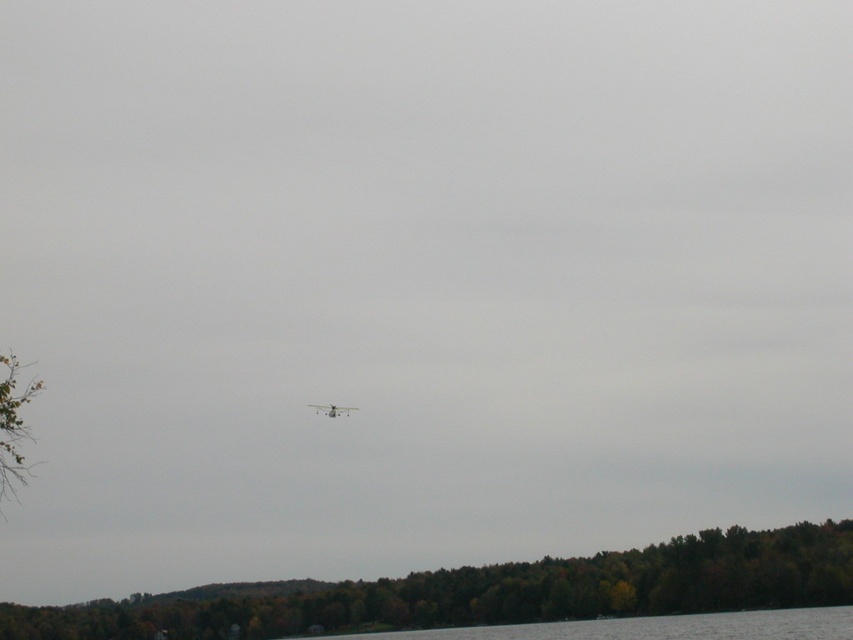
Is green matte tree at lower center further to the viewer compared to clear water at lower center?

Yes, green matte tree at lower center is further from the viewer.

Between point (248, 589) and point (672, 620), which one is positioned in front?

Point (672, 620)

Identify the location of green matte tree at lower center. (485, 592).

Is green matte tree at lower center to the left of metallic silver airplane at center from the viewer's perspective?

Incorrect, green matte tree at lower center is not on the left side of metallic silver airplane at center.

Who is higher up, green matte tree at lower center or metallic silver airplane at center?

metallic silver airplane at center is higher up.

What do you see at coordinates (485, 592) in the screenshot?
I see `green matte tree at lower center` at bounding box center [485, 592].

Identify the location of green matte tree at lower center. (485, 592).

Does green matte tree at lower center appear over green leafy tree at left?

Actually, green matte tree at lower center is below green leafy tree at left.

What do you see at coordinates (485, 592) in the screenshot? This screenshot has height=640, width=853. I see `green matte tree at lower center` at bounding box center [485, 592].

This screenshot has width=853, height=640. In order to click on green matte tree at lower center in this screenshot , I will do `click(485, 592)`.